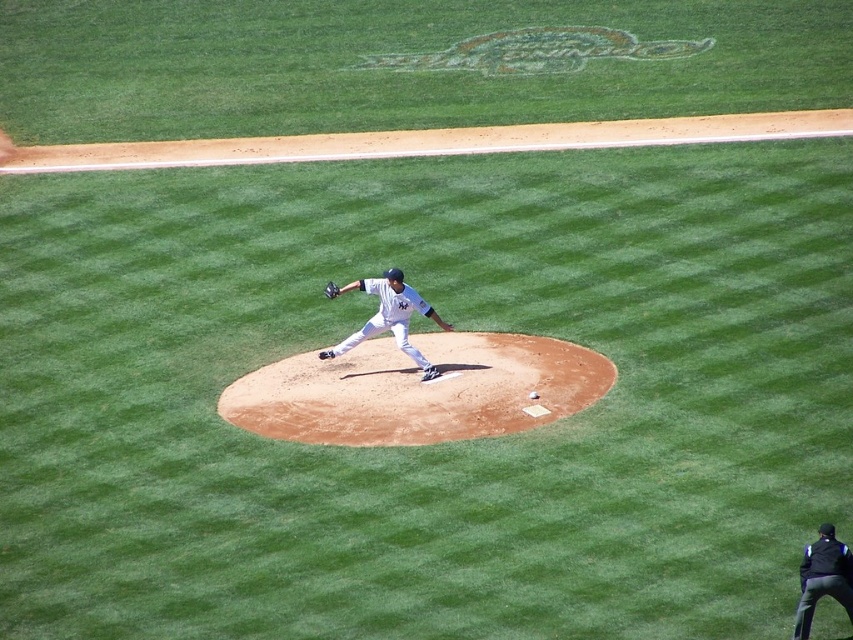
You are a spectator at the baseball game and want to locate the black fabric jacket at lower right and the white matte baseball at center. From your perspective, which object is closer to the right edge of the image?

The black fabric jacket at lower right is positioned on the right side of the white matte baseball at center, so it is closer to the right edge of the image.

You are a baseball player standing at the pitcher position. You need to throw the ball to the catcher. The brown dirt mound at center and the dark brown leather glove at center are in your view. Which object is closer to you?

The brown dirt mound at center is closer to you because it is in front of the dark brown leather glove at center.